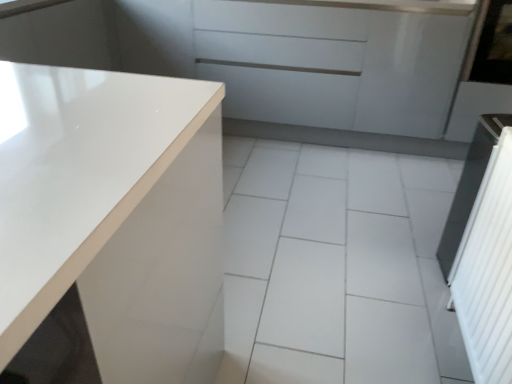
Question: Considering the positions of glossy white screen door at right, which is counted as the second screen door, starting from the left, and white glossy countertop at left in the image, is glossy white screen door at right, which is counted as the second screen door, starting from the left, bigger or smaller than white glossy countertop at left?

Choices:
 (A) big
 (B) small

Answer: (B)

Question: From a real-world perspective, relative to white glossy countertop at left, is glossy white screen door at right, the 2th screen door when ordered from front to back, vertically above or below?

Choices:
 (A) above
 (B) below

Answer: (A)

Question: Considering the real-world distances, which object is farthest from the glossy white cabinet at upper center?

Choices:
 (A) white glossy tile at center
 (B) transparent glass window screen at upper right
 (C) white textured screen door at right, the first screen door viewed from the left
 (D) glossy white screen door at right, the 2th screen door when ordered from front to back
 (E) white glossy countertop at left

Answer: (E)

Question: Which object is positioned farthest from the glossy white cabinet at upper center?

Choices:
 (A) glossy white screen door at right, the 2th screen door when ordered from front to back
 (B) white glossy countertop at left
 (C) transparent glass window screen at upper right
 (D) white glossy tile at center
 (E) white textured screen door at right, which is counted as the first screen door, starting from the bottom

Answer: (B)